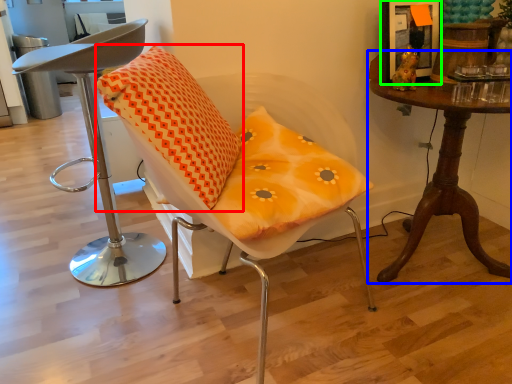
Question: Based on their relative distances, which object is nearer to pillow (highlighted by a red box)? Choose from table (highlighted by a blue box) and picture frame (highlighted by a green box).

Choices:
 (A) table
 (B) picture frame

Answer: (A)